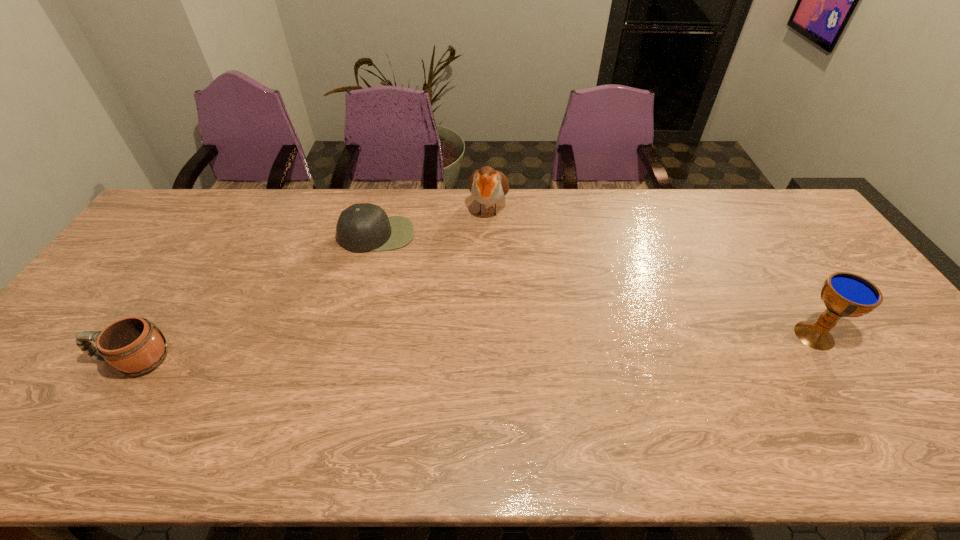
Identify the location of mug. The image size is (960, 540). (133, 346).

Locate an element on the screen. the rightmost object is located at coordinates (844, 294).

Image resolution: width=960 pixels, height=540 pixels. I want to click on bird, so click(488, 186).

Where is `cap`? The width and height of the screenshot is (960, 540). cap is located at coordinates (363, 227).

You are a GUI agent. You are given a task and a screenshot of the screen. Output one action in this format:
    pyautogui.click(x=<x>, y=<y>)
    Task: Click on the free point located 0.080m on the side of the leftmost object with the handle
    This screenshot has width=960, height=540.
    Given the screenshot: What is the action you would take?
    pyautogui.click(x=64, y=360)

Locate an element on the screen. vacant space located 0.160m on the front of the chalice is located at coordinates click(x=864, y=413).

You are a GUI agent. You are given a task and a screenshot of the screen. Output one action in this format:
    pyautogui.click(x=<x>, y=<y>)
    Task: Click on the vacant space situated 0.170m at the face of the third object from left to right
    
    Given the screenshot: What is the action you would take?
    pyautogui.click(x=478, y=266)

Find the location of a particular element. The image size is (960, 540). vacant area located 0.300m at the face of the third object from left to right is located at coordinates (472, 299).

Identify the location of vacant space located 0.190m at the face of the third object from left to right. (477, 271).

What are the coordinates of `free spot located 0.060m on the brim of the cap` in the screenshot? It's located at (381, 266).